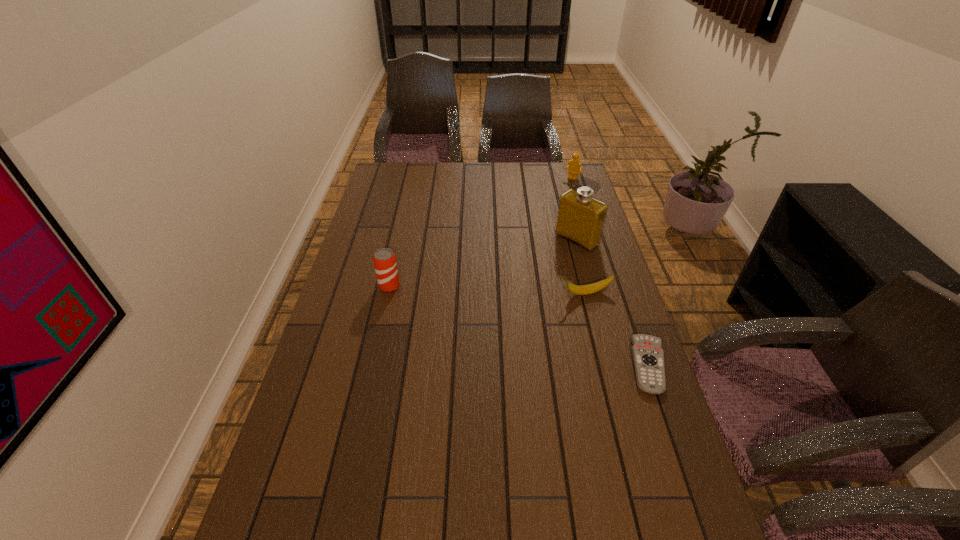
You are a GUI agent. You are given a task and a screenshot of the screen. Output one action in this format:
    pyautogui.click(x=<x>, y=<y>)
    Task: Click on the vacant space that satisfies the following two spatial constraints: 1. on the back side of the leftmost object; 2. on the right side of the tallest object
    
    Given the screenshot: What is the action you would take?
    pyautogui.click(x=399, y=240)